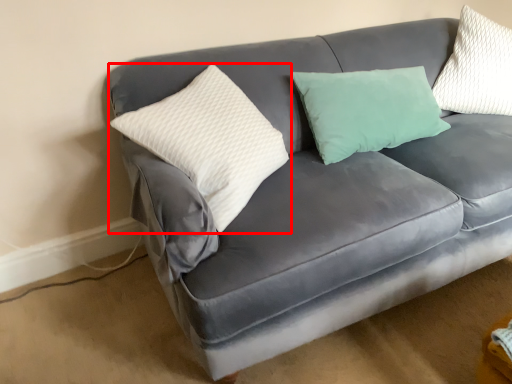
Question: Where is pillow (annotated by the red box) located in relation to pillow in the image?

Choices:
 (A) right
 (B) left

Answer: (B)